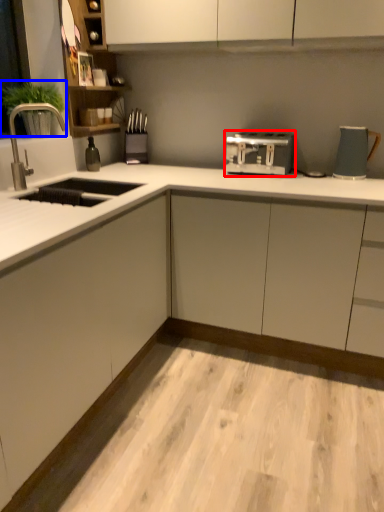
Question: Which point is closer to the camera, home appliance (highlighted by a red box) or plant (highlighted by a blue box)?

Choices:
 (A) home appliance
 (B) plant

Answer: (B)